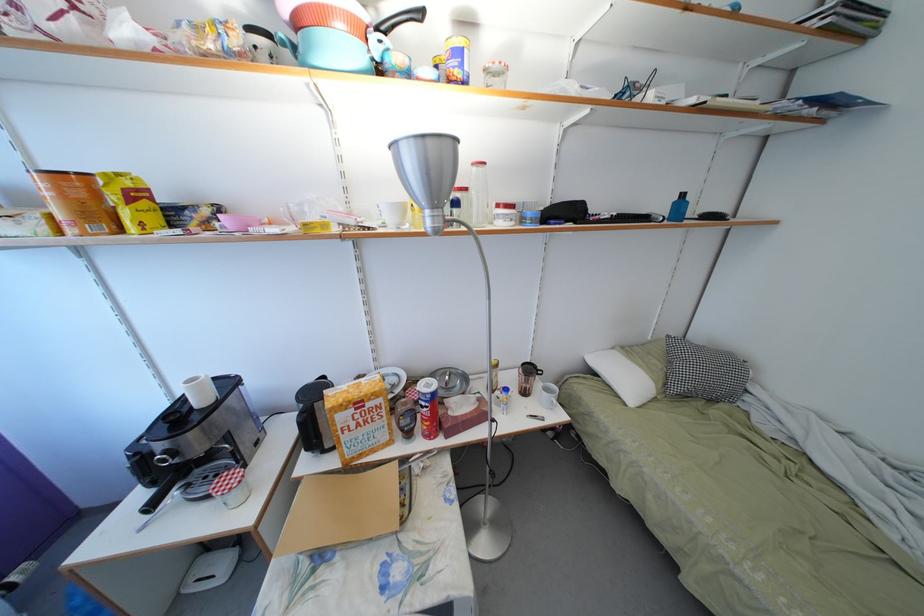
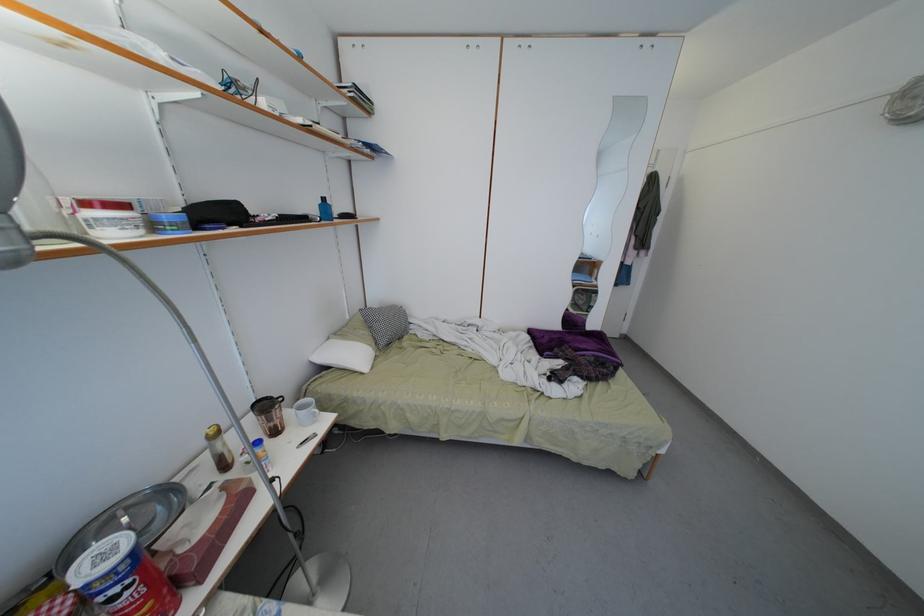
Where in the second image is the point corresponding to (x=535, y=220) from the first image?

(171, 224)